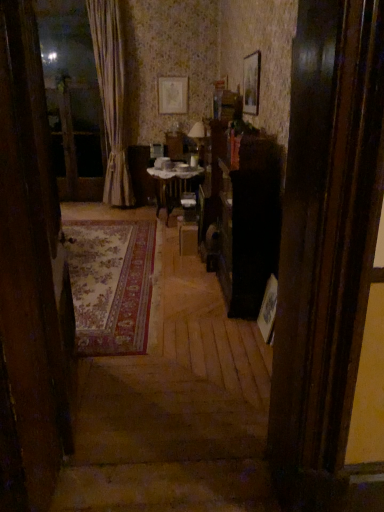
Image resolution: width=384 pixels, height=512 pixels. I want to click on free space to the back side of carpeted rug at left, so click(117, 345).